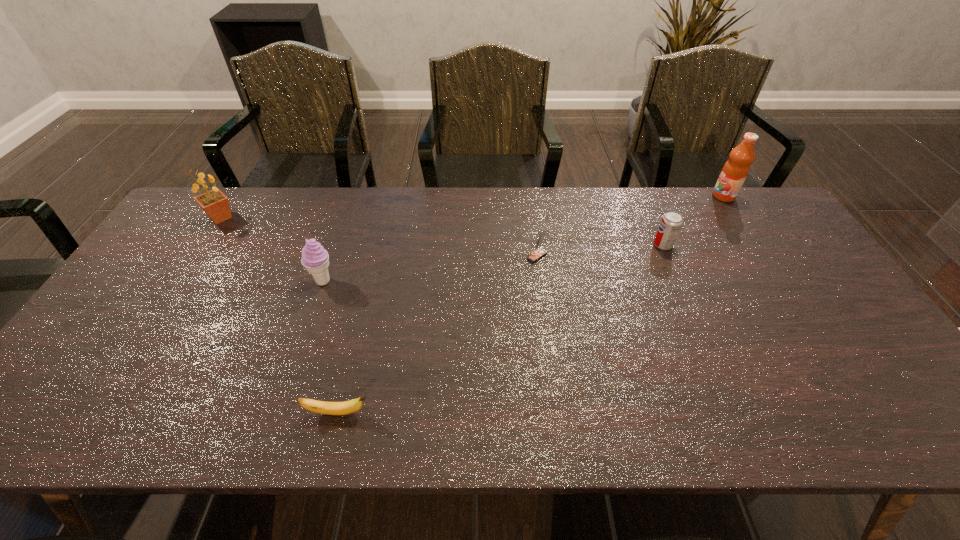
This screenshot has height=540, width=960. Identify the location of object present at the near edge. (347, 407).

What are the coordinates of `object at the left edge` in the screenshot? It's located at tap(215, 204).

Locate an element on the screen. object that is at the right edge is located at coordinates (736, 169).

The width and height of the screenshot is (960, 540). Identify the location of object that is at the far left corner. (215, 204).

This screenshot has width=960, height=540. Find the location of `object located in the far right corner section of the desktop`. object located in the far right corner section of the desktop is located at coordinates (736, 169).

In the image, there is a desktop. In order to click on blank space at the far edge in this screenshot , I will do `click(270, 225)`.

Locate an element on the screen. vacant space at the near edge of the desktop is located at coordinates (684, 408).

The height and width of the screenshot is (540, 960). Identify the location of vacant space at the left edge. (105, 327).

In order to click on free space at the right edge in this screenshot , I will do `click(852, 353)`.

The image size is (960, 540). Find the location of `free point at the far left corner`. free point at the far left corner is located at coordinates (227, 193).